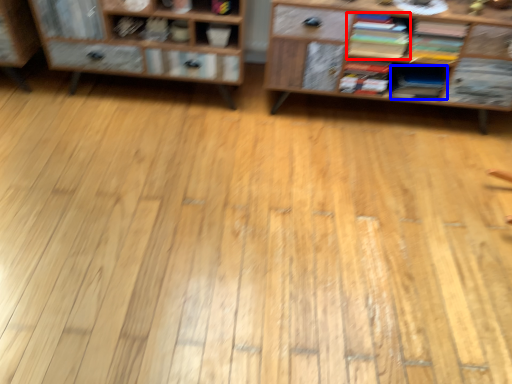
Question: Which object is further to the camera taking this photo, book (highlighted by a red box) or book (highlighted by a blue box)?

Choices:
 (A) book
 (B) book

Answer: (B)